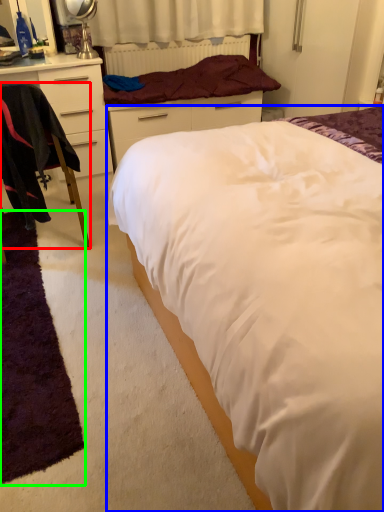
Question: Which object is positioned farthest from chair (highlighted by a red box)? Select from bed (highlighted by a blue box) and mat (highlighted by a green box).

Choices:
 (A) bed
 (B) mat

Answer: (A)